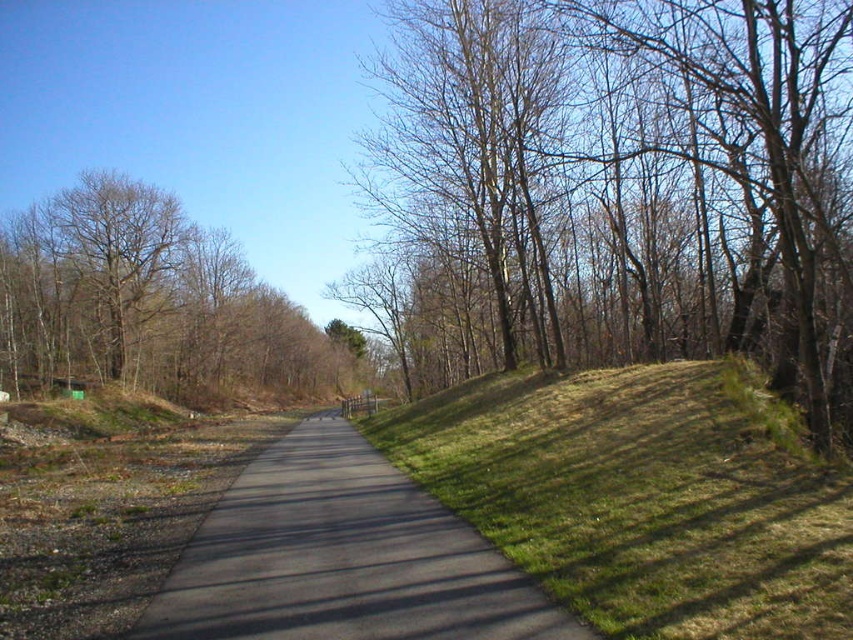
Is brown/dry wood trees at right bigger than black asphalt path at center?

Indeed, brown/dry wood trees at right has a larger size compared to black asphalt path at center.

Who is positioned more to the left, brown/dry wood trees at right or black asphalt path at center?

From the viewer's perspective, black asphalt path at center appears more on the left side.

Between point (514, 67) and point (306, 467), which one is positioned behind?

Point (514, 67)

Locate an element on the screen. The image size is (853, 640). brown/dry wood trees at right is located at coordinates (636, 172).

You are a GUI agent. You are given a task and a screenshot of the screen. Output one action in this format:
    pyautogui.click(x=<x>, y=<y>)
    Task: Click on the green grassy hillside at right
    This screenshot has height=640, width=853.
    Given the screenshot: What is the action you would take?
    pyautogui.click(x=640, y=499)

Which is in front, point (432, 403) or point (515, 620)?

Point (515, 620)

Is point (828, 525) positioned in front of point (244, 602)?

That is False.

Where is `green grassy hillside at right`? The width and height of the screenshot is (853, 640). green grassy hillside at right is located at coordinates (640, 499).

Does brown/dry wood trees at right have a larger size compared to brown leafless tree at left?

Correct, brown/dry wood trees at right is larger in size than brown leafless tree at left.

Image resolution: width=853 pixels, height=640 pixels. Describe the element at coordinates (636, 172) in the screenshot. I see `brown/dry wood trees at right` at that location.

Does point (796, 10) come in front of point (83, 300)?

That is True.

Find the location of `brown/dry wood trees at right`. brown/dry wood trees at right is located at coordinates [x=636, y=172].